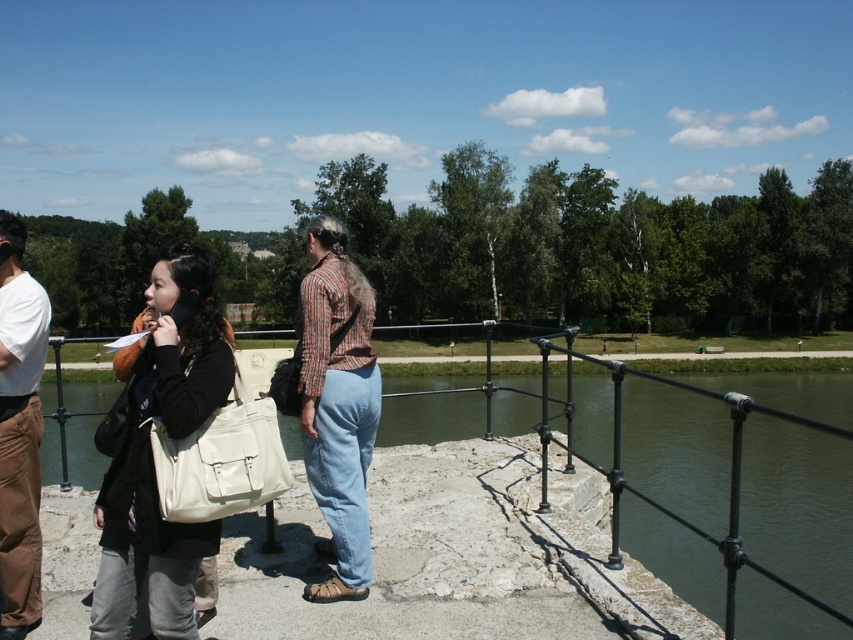
Question: Does matte white bag at center appear over denim pants at center?

Choices:
 (A) yes
 (B) no

Answer: (B)

Question: Does denim pants at center appear on the right side of brown suede pants at left?

Choices:
 (A) no
 (B) yes

Answer: (B)

Question: Which point appears closest to the camera in this image?

Choices:
 (A) (318, 400)
 (B) (317, 241)
 (C) (18, 563)
 (D) (115, 493)

Answer: (D)

Question: Is matte black jacket at left closer to the viewer compared to brown suede pants at left?

Choices:
 (A) yes
 (B) no

Answer: (A)

Question: Which object is the closest to the brown suede pants at left?

Choices:
 (A) matte white bag at center
 (B) denim pants at center

Answer: (B)

Question: Which point appears closest to the camera in this image?

Choices:
 (A) (24, 445)
 (B) (187, 545)
 (C) (103, 436)
 (D) (302, 355)

Answer: (B)